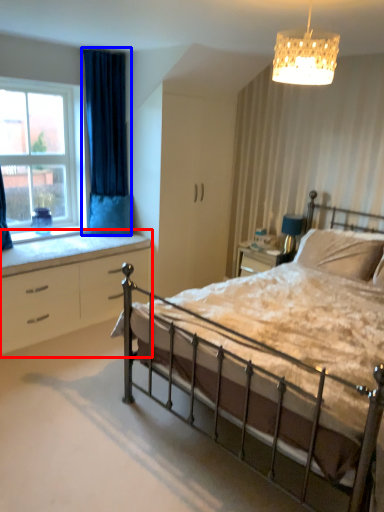
Question: Among these objects, which one is farthest to the camera, chest of drawers (highlighted by a red box) or curtain (highlighted by a blue box)?

Choices:
 (A) chest of drawers
 (B) curtain

Answer: (B)